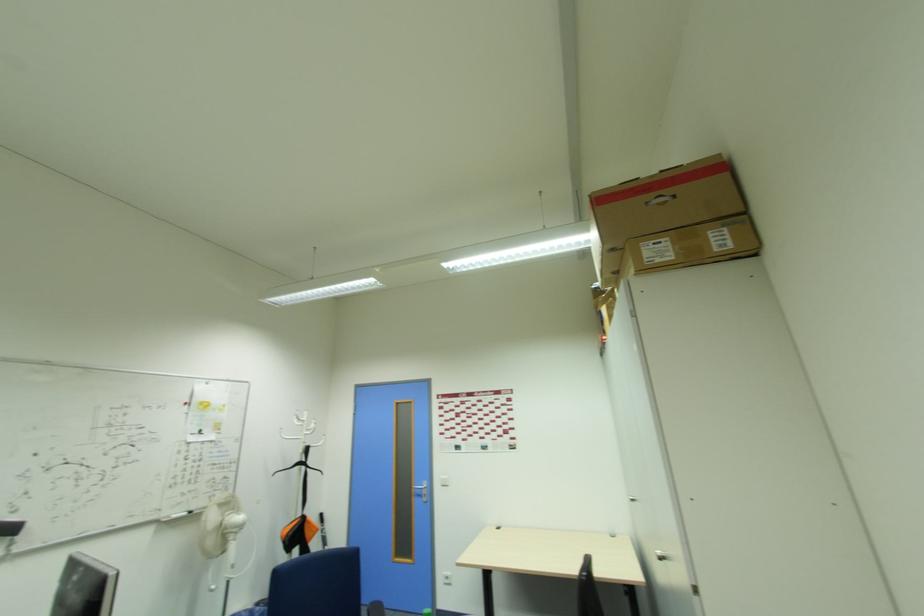
At what (x,y) coordinates should I click in order to perform the action: click on small cabinet knob. Please return your answer as a coordinate pair (x, y). The height and width of the screenshot is (616, 924). Looking at the image, I should click on (661, 554).